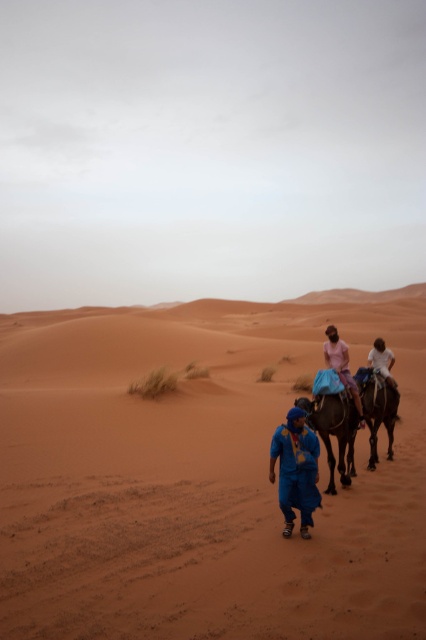
Is brown textured camel at center smaller than blue fabric at center?

No, brown textured camel at center is not smaller than blue fabric at center.

Which is in front, point (371, 465) or point (284, 512)?

Point (284, 512) is more forward.

In order to click on brown textured camel at center in this screenshot , I will do `click(333, 429)`.

Is point (288, 490) positioned behind point (394, 381)?

That is False.

Does blue fabric at center have a larger size compared to white matte shirt at center?

Yes, blue fabric at center is bigger than white matte shirt at center.

Is point (302, 522) positioned before point (385, 356)?

Yes, it is in front of point (385, 356).

At what (x,y) coordinates should I click in order to perform the action: click on blue fabric at center. Please return your answer as a coordinate pair (x, y). Image resolution: width=426 pixels, height=640 pixels. Looking at the image, I should click on click(296, 470).

Between point (365, 381) and point (377, 340), which one is positioned behind?

Point (377, 340)

Does brown textured camel at center-right appear under white matte shirt at center?

Yes, brown textured camel at center-right is below white matte shirt at center.

Between point (382, 406) and point (382, 353), which one is positioned in front?

Point (382, 406) is in front.

The image size is (426, 640). Identify the location of brown textured camel at center-right. (377, 408).